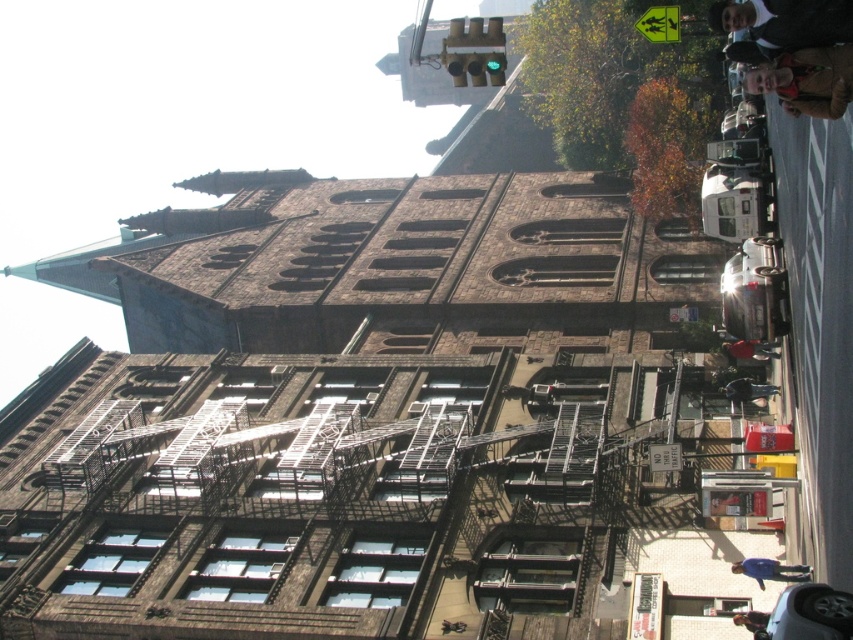
Does light brown leather jacket at upper right come behind dark brown leather jacket at lower right?

No, it is not.

From the picture: Who is more forward, (775, 67) or (755, 387)?

Point (775, 67) is in front.

You are a GUI agent. You are given a task and a screenshot of the screen. Output one action in this format:
    pyautogui.click(x=<x>, y=<y>)
    Task: Click on the light brown leather jacket at upper right
    The image size is (853, 640).
    Given the screenshot: What is the action you would take?
    pyautogui.click(x=805, y=81)

Which is behind, point (743, 19) or point (741, 340)?

Positioned behind is point (741, 340).

Which is more to the right, dark brown leather jacket at upper right or red fabric jacket at lower right?

red fabric jacket at lower right

Does point (811, 20) lie in front of point (740, 348)?

Yes, point (811, 20) is closer to viewer.

The height and width of the screenshot is (640, 853). Find the location of `dark brown leather jacket at upper right`. dark brown leather jacket at upper right is located at coordinates (785, 20).

Looking at this image, is dark brown leather jacket at lower right to the right of brown leather jacket at lower right from the viewer's perspective?

Indeed, dark brown leather jacket at lower right is positioned on the right side of brown leather jacket at lower right.

Measure the distance between dark brown leather jacket at lower right and camera.

dark brown leather jacket at lower right and camera are 172.60 feet apart.

Is point (728, 385) closer to viewer compared to point (764, 628)?

That is False.

Locate an element on the screen. Image resolution: width=853 pixels, height=640 pixels. dark brown leather jacket at lower right is located at coordinates (747, 388).